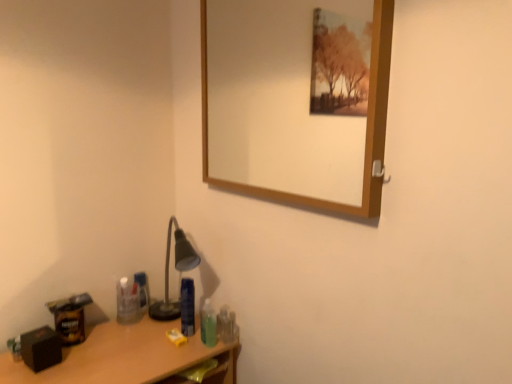
Question: Can you confirm if blue plastic bottle at lower center, the 3th toiletry positioned from the front, is bigger than translucent plastic toothbrush at lower right, which is counted as the 3th toiletry, starting from the back?

Choices:
 (A) no
 (B) yes

Answer: (B)

Question: Does blue plastic bottle at lower center, marked as the 3th toiletry in a right-to-left arrangement, have a greater width compared to translucent plastic toothbrush at lower right, which is counted as the 3th toiletry, starting from the back?

Choices:
 (A) yes
 (B) no

Answer: (B)

Question: From a real-world perspective, is blue plastic bottle at lower center, the 3th toiletry positioned from the front, physically below translucent plastic toothbrush at lower right, the 2th toiletry positioned from the front?

Choices:
 (A) no
 (B) yes

Answer: (A)

Question: Can you confirm if blue plastic bottle at lower center, marked as the 3th toiletry in a right-to-left arrangement, is shorter than translucent plastic toothbrush at lower right, the first toiletry from the right?

Choices:
 (A) no
 (B) yes

Answer: (A)

Question: Considering the relative sizes of blue plastic bottle at lower center, the 2th toiletry from the left, and translucent plastic toothbrush at lower right, the first toiletry from the right, in the image provided, is blue plastic bottle at lower center, the 2th toiletry from the left, thinner than translucent plastic toothbrush at lower right, the first toiletry from the right,?

Choices:
 (A) yes
 (B) no

Answer: (A)

Question: Does point (266, 112) appear closer or farther from the camera than point (190, 283)?

Choices:
 (A) farther
 (B) closer

Answer: (A)

Question: Is wooden-framed mirror at upper center inside the boundaries of blue plastic bottle at lower center, the 2th toiletry from the left, or outside?

Choices:
 (A) inside
 (B) outside

Answer: (B)

Question: From a real-world perspective, is wooden-framed mirror at upper center physically located above or below blue plastic bottle at lower center, the 2th toiletry from the left?

Choices:
 (A) above
 (B) below

Answer: (A)

Question: Looking at their shapes, would you say wooden-framed mirror at upper center is wider or thinner than blue plastic bottle at lower center, the 2th toiletry from the left?

Choices:
 (A) wide
 (B) thin

Answer: (A)

Question: In terms of width, does translucent plastic toothbrush at lower right, the 2th toiletry positioned from the front, look wider or thinner when compared to blue plastic bottle at lower center, the 2th toiletry when ordered from back to front?

Choices:
 (A) thin
 (B) wide

Answer: (B)

Question: In terms of height, does translucent plastic toothbrush at lower right, which is counted as the 3th toiletry, starting from the back, look taller or shorter compared to blue plastic bottle at lower center, the 2th toiletry when ordered from back to front?

Choices:
 (A) tall
 (B) short

Answer: (B)

Question: From a real-world perspective, is translucent plastic toothbrush at lower right, the first toiletry from the right, positioned above or below blue plastic bottle at lower center, marked as the 3th toiletry in a right-to-left arrangement?

Choices:
 (A) above
 (B) below

Answer: (B)

Question: In the image, is translucent plastic toothbrush at lower right, which is counted as the 3th toiletry, starting from the back, on the left side or the right side of blue plastic bottle at lower center, the 3th toiletry positioned from the front?

Choices:
 (A) left
 (B) right

Answer: (B)

Question: Is wooden desk at lower left situated inside translucent plastic toothbrush at lower right, which appears as the fourth toiletry when viewed from the left, or outside?

Choices:
 (A) outside
 (B) inside

Answer: (A)

Question: Based on their sizes in the image, would you say wooden desk at lower left is bigger or smaller than translucent plastic toothbrush at lower right, the 2th toiletry positioned from the front?

Choices:
 (A) small
 (B) big

Answer: (B)